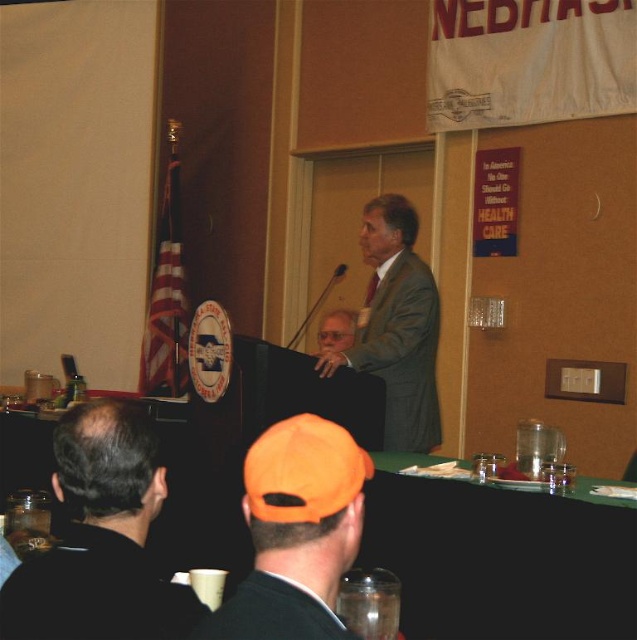
Question: Among these points, which one is farthest from the camera?

Choices:
 (A) (324, 637)
 (B) (248, 636)
 (C) (75, 480)
 (D) (434, 515)

Answer: (D)

Question: Does black fabric jacket at lower left appear on the left side of matte gray suit at center?

Choices:
 (A) yes
 (B) no

Answer: (A)

Question: Which object is the closest to the black fabric jacket at lower left?

Choices:
 (A) orange fabric cap at lower center
 (B) black matte suit at lower left

Answer: (B)

Question: Can you confirm if black matte suit at lower left is positioned to the left of matte gray suit at center?

Choices:
 (A) yes
 (B) no

Answer: (A)

Question: Which point is farther to the camera?

Choices:
 (A) green fabric table at lower center
 (B) metallic silver microphone at upper center
 (C) black matte suit at lower center
 (D) black fabric jacket at lower left

Answer: (B)

Question: Is green fabric table at lower center positioned in front of metallic silver microphone at upper center?

Choices:
 (A) yes
 (B) no

Answer: (A)